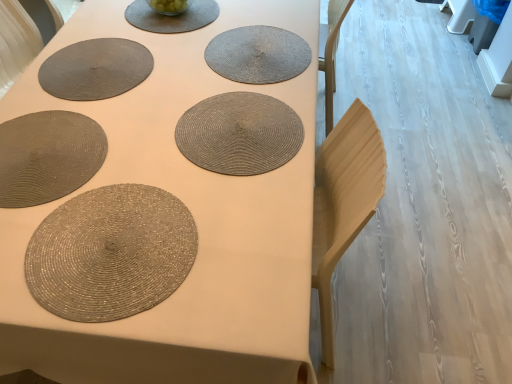
Find the location of a particular element. The height and width of the screenshot is (384, 512). free space that is in between matte gray placemat at upper left, which appears as the 3th paper plate when viewed from the front, and shiny metallic placemat at bottom left, which ranks as the third paper plate in top-to-bottom order is located at coordinates (91, 139).